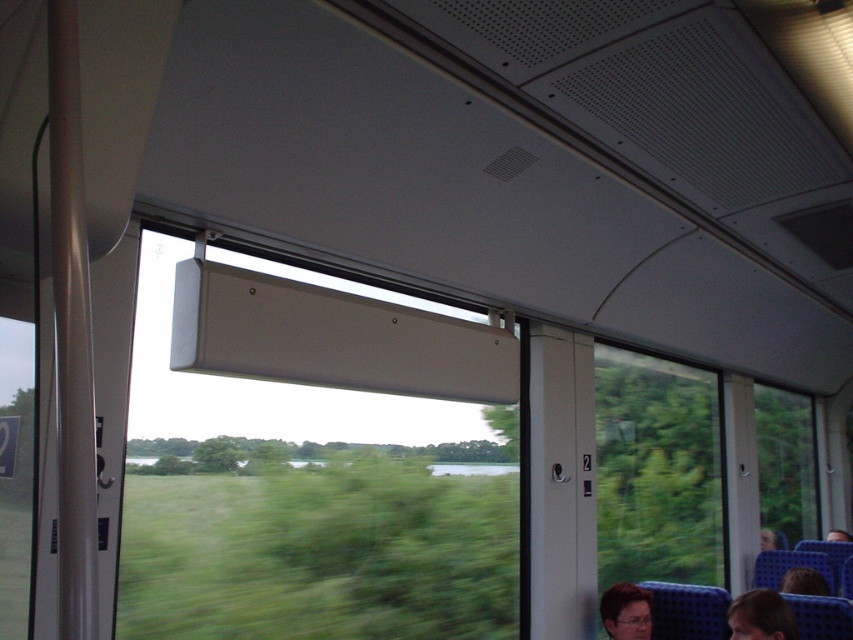
You are a passenger sitting in the train car and notice two items at the lower right corner of the window area. Which one is closer to the window frame? The dark brown hair at lower right or the blue fabric headrest at lower right?

The dark brown hair at lower right is to the left of the blue fabric headrest at lower right, so it is closer to the window frame.